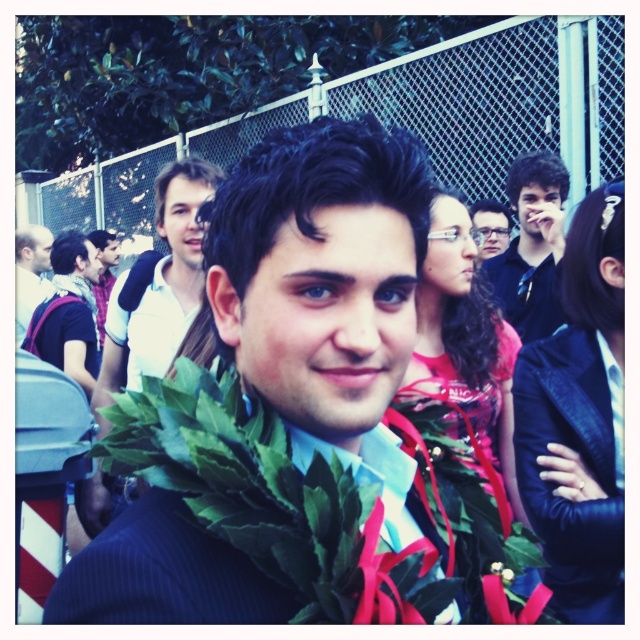
Question: Is dark blue shirt at upper right wider than matte white shirt at center?

Choices:
 (A) yes
 (B) no

Answer: (B)

Question: Among these objects, which one is farthest from the camera?

Choices:
 (A) matte white shirt at left
 (B) matte white shirt at center

Answer: (A)

Question: Which point is closer to the camera?

Choices:
 (A) matte black glasses at upper center
 (B) dark blue shirt at upper right
 (C) white shirt at upper left
 (D) matte white shirt at center

Answer: (C)

Question: Can you confirm if matte white shirt at left is smaller than matte black glasses at upper center?

Choices:
 (A) yes
 (B) no

Answer: (B)

Question: Does white shirt at upper left have a smaller size compared to matte white shirt at left?

Choices:
 (A) yes
 (B) no

Answer: (B)

Question: Based on their relative distances, which object is farther from the matte white shirt at center?

Choices:
 (A) matte white shirt at left
 (B) white shirt at upper left

Answer: (B)